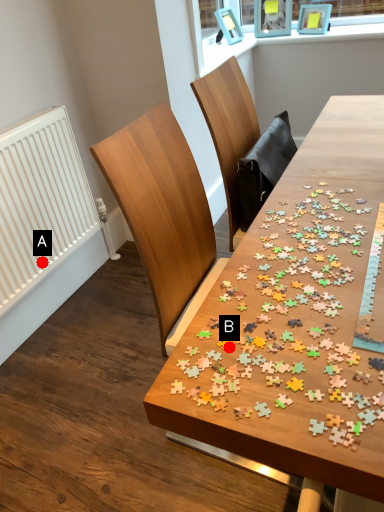
Question: Two points are circled on the image, labeled by A and B beside each circle. Which point is closer to the camera?

Choices:
 (A) A is closer
 (B) B is closer

Answer: (B)